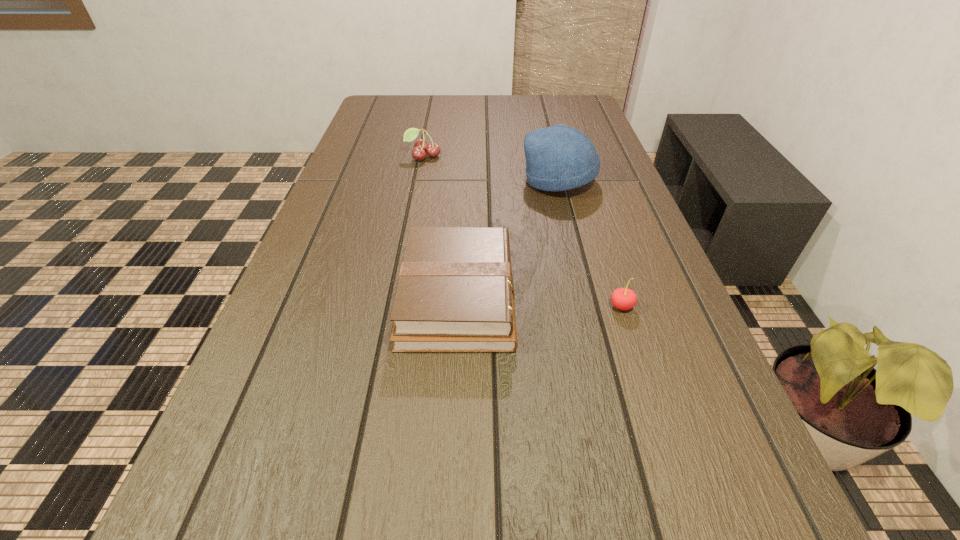
In order to click on skullcap in this screenshot , I will do `click(558, 158)`.

The image size is (960, 540). I want to click on the farther cherry, so click(421, 147).

Where is `the nearer cherry`? the nearer cherry is located at coordinates (622, 298).

Locate an element on the screen. Bible is located at coordinates (455, 293).

In order to click on free location located 0.290m on the back of the skullcap in this screenshot , I will do `click(544, 120)`.

Where is `blank space located 0.070m on the leaves of the farther cherry`? This screenshot has width=960, height=540. blank space located 0.070m on the leaves of the farther cherry is located at coordinates (420, 177).

The width and height of the screenshot is (960, 540). What are the coordinates of `vacant area situated on the front of the right cherry` in the screenshot? It's located at (660, 423).

The height and width of the screenshot is (540, 960). Find the location of `vacant space located on the spine side of the Bible`. vacant space located on the spine side of the Bible is located at coordinates (549, 297).

Image resolution: width=960 pixels, height=540 pixels. In order to click on skullcap that is at the right edge in this screenshot , I will do `click(558, 158)`.

At what (x,y) coordinates should I click in order to perform the action: click on cherry present at the right edge. Please return your answer as a coordinate pair (x, y). This screenshot has height=540, width=960. Looking at the image, I should click on (622, 298).